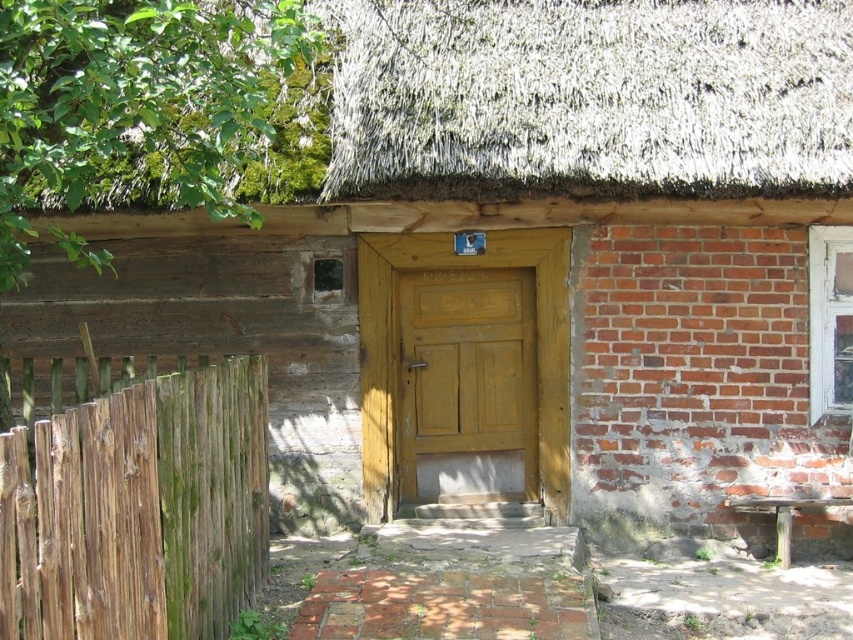
Between green mossy wood fence at left and wooden door at center, which one appears on the left side from the viewer's perspective?

From the viewer's perspective, green mossy wood fence at left appears more on the left side.

Is the position of green mossy wood fence at left more distant than that of wooden door at center?

No, green mossy wood fence at left is closer to the viewer.

The height and width of the screenshot is (640, 853). What do you see at coordinates (138, 509) in the screenshot?
I see `green mossy wood fence at left` at bounding box center [138, 509].

At what (x,y) coordinates should I click in order to perform the action: click on green mossy wood fence at left. Please return your answer as a coordinate pair (x, y). This screenshot has width=853, height=640. Looking at the image, I should click on point(138,509).

Between thatched straw roof at upper center and wooden door at center, which one is positioned lower?

wooden door at center

Locate an element on the screen. This screenshot has width=853, height=640. thatched straw roof at upper center is located at coordinates (590, 97).

This screenshot has height=640, width=853. I want to click on thatched straw roof at upper center, so click(590, 97).

Who is higher up, thatched straw roof at upper center or green mossy wood fence at left?

Positioned higher is thatched straw roof at upper center.

Does thatched straw roof at upper center appear on the right side of green mossy wood fence at left?

Yes, thatched straw roof at upper center is to the right of green mossy wood fence at left.

Which is behind, point (514, 128) or point (109, 477)?

Point (514, 128)

Find the location of a particular element. The width and height of the screenshot is (853, 640). thatched straw roof at upper center is located at coordinates (590, 97).